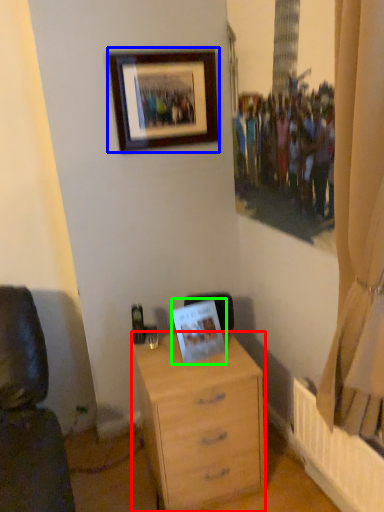
Question: Which object is positioned closest to chest of drawers (highlighted by a red box)? Select from picture frame (highlighted by a blue box) and picture frame (highlighted by a green box).

Choices:
 (A) picture frame
 (B) picture frame

Answer: (B)